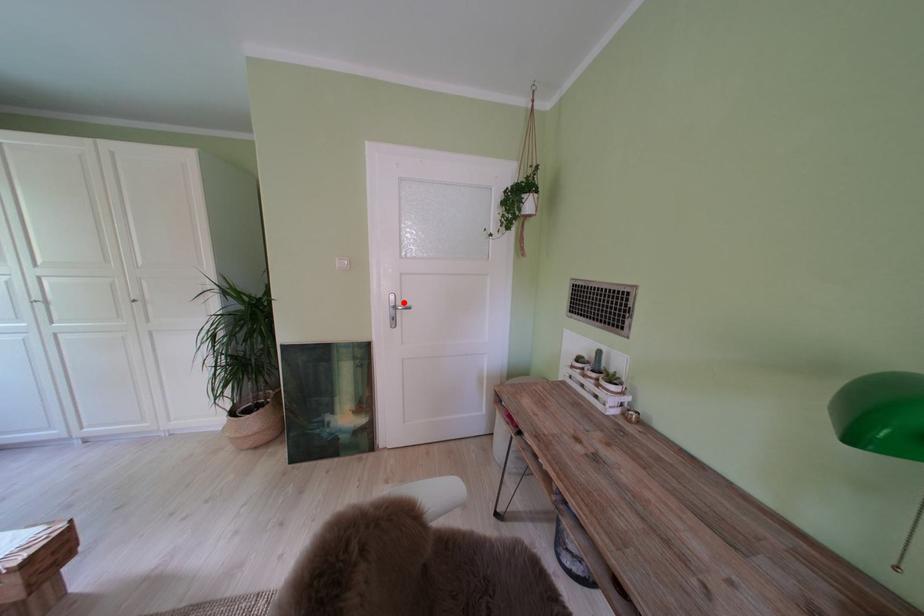
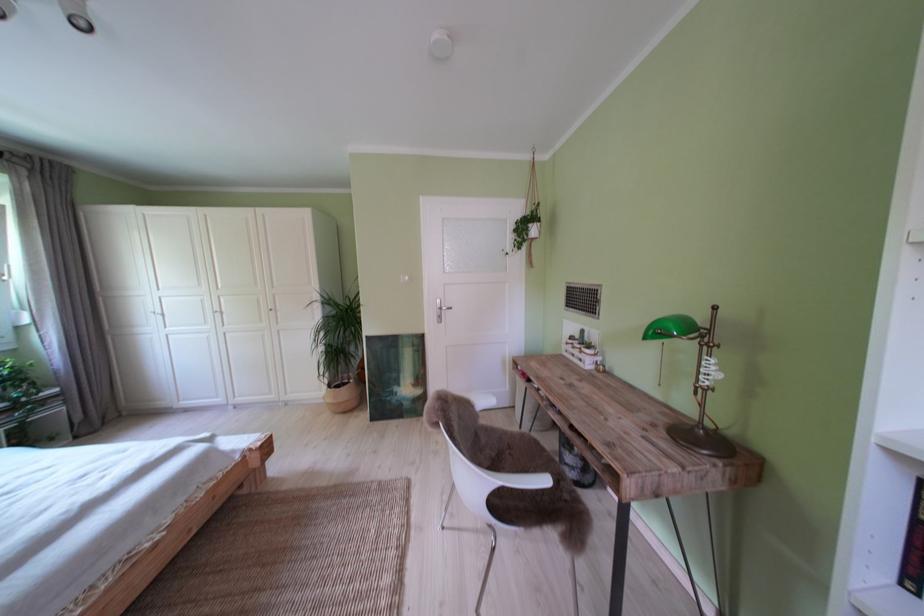
The point at the highlighted location is marked in the first image. Where is the corresponding point in the second image?

(450, 307)